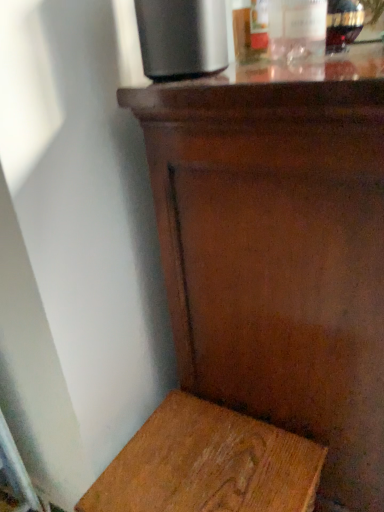
What do you see at coordinates (279, 249) in the screenshot?
I see `shiny brown wood table at center` at bounding box center [279, 249].

Identify the location of wooden stool at lower left. (208, 465).

Describe the element at coordinates (182, 38) in the screenshot. I see `satin black speaker at upper center` at that location.

The image size is (384, 512). In order to click on translucent glass bottle at upper right, which ranks as the second bottle in left-to-right order in this screenshot , I will do `click(343, 24)`.

Identify the location of shiny brown wood table at center. (279, 249).

Considering the relative positions of wooden stool at lower left and clear glass bottle at upper right, marked as the first bottle in a left-to-right arrangement, in the image provided, is wooden stool at lower left to the left or to the right of clear glass bottle at upper right, marked as the first bottle in a left-to-right arrangement,?

wooden stool at lower left is positioned on clear glass bottle at upper right, marked as the first bottle in a left-to-right arrangement,'s left side.

Does wooden stool at lower left contain clear glass bottle at upper right, marked as the 2th bottle in a right-to-left arrangement?

Actually, clear glass bottle at upper right, marked as the 2th bottle in a right-to-left arrangement, is outside wooden stool at lower left.

Considering the relative sizes of wooden stool at lower left and clear glass bottle at upper right, marked as the 2th bottle in a right-to-left arrangement, in the image provided, is wooden stool at lower left taller than clear glass bottle at upper right, marked as the 2th bottle in a right-to-left arrangement,?

Indeed, wooden stool at lower left has a greater height compared to clear glass bottle at upper right, marked as the 2th bottle in a right-to-left arrangement.

In order to click on the 2nd bottle positioned above the wooden stool at lower left (from the image's perspective) in this screenshot , I will do `click(303, 29)`.

Which of these two, wooden stool at lower left or translucent glass bottle at upper right, which ranks as the second bottle in left-to-right order, stands taller?

Standing taller between the two is wooden stool at lower left.

The height and width of the screenshot is (512, 384). In order to click on furniture that appears on the left of translucent glass bottle at upper right, the 1th bottle when ordered from right to left in this screenshot , I will do `click(208, 465)`.

Can translucent glass bottle at upper right, which ranks as the second bottle in left-to-right order, be found inside wooden stool at lower left?

No, translucent glass bottle at upper right, which ranks as the second bottle in left-to-right order, is not inside wooden stool at lower left.

Who is bigger, wooden stool at lower left or translucent glass bottle at upper right, which ranks as the second bottle in left-to-right order?

With larger size is wooden stool at lower left.

Who is taller, translucent glass bottle at upper right, the 1th bottle when ordered from right to left, or clear glass bottle at upper right, marked as the first bottle in a left-to-right arrangement?

clear glass bottle at upper right, marked as the first bottle in a left-to-right arrangement.

Is translucent glass bottle at upper right, the 1th bottle when ordered from right to left, oriented away from clear glass bottle at upper right, marked as the first bottle in a left-to-right arrangement?

No.

Considering the relative sizes of translucent glass bottle at upper right, the 1th bottle when ordered from right to left, and clear glass bottle at upper right, marked as the 2th bottle in a right-to-left arrangement, in the image provided, is translucent glass bottle at upper right, the 1th bottle when ordered from right to left, bigger than clear glass bottle at upper right, marked as the 2th bottle in a right-to-left arrangement,?

No.

From the image's perspective, which one is positioned lower, satin black speaker at upper center or wooden stool at lower left?

wooden stool at lower left appears lower in the image.

Is satin black speaker at upper center to the left or to the right of wooden stool at lower left in the image?

In the image, satin black speaker at upper center appears on the left side of wooden stool at lower left.

Is satin black speaker at upper center not near wooden stool at lower left?

They are positioned close to each other.

Is satin black speaker at upper center spatially inside wooden stool at lower left, or outside of it?

satin black speaker at upper center exists outside the volume of wooden stool at lower left.

From the picture: From the image's perspective, is clear glass bottle at upper right, marked as the 2th bottle in a right-to-left arrangement, on top of satin black speaker at upper center?

Yes, from the image's perspective, clear glass bottle at upper right, marked as the 2th bottle in a right-to-left arrangement, is over satin black speaker at upper center.

Is clear glass bottle at upper right, marked as the first bottle in a left-to-right arrangement, taller than satin black speaker at upper center?

No, clear glass bottle at upper right, marked as the first bottle in a left-to-right arrangement, is not taller than satin black speaker at upper center.

From a real-world perspective, is clear glass bottle at upper right, marked as the 2th bottle in a right-to-left arrangement, on top of satin black speaker at upper center?

Correct, in the physical world, clear glass bottle at upper right, marked as the 2th bottle in a right-to-left arrangement, is higher than satin black speaker at upper center.

How many degrees apart are the facing directions of shiny brown wood table at center and translucent glass bottle at upper right, which ranks as the second bottle in left-to-right order?

They differ by 0.698 degrees in their facing directions.

Does shiny brown wood table at center come behind translucent glass bottle at upper right, the 1th bottle when ordered from right to left?

That is False.

Considering the sizes of objects shiny brown wood table at center and translucent glass bottle at upper right, which ranks as the second bottle in left-to-right order, in the image provided, who is taller, shiny brown wood table at center or translucent glass bottle at upper right, which ranks as the second bottle in left-to-right order,?

shiny brown wood table at center.

From a real-world perspective, which object stands above the other?

translucent glass bottle at upper right, which ranks as the second bottle in left-to-right order.

Would you say wooden stool at lower left is outside satin black speaker at upper center?

wooden stool at lower left is positioned outside satin black speaker at upper center.

Is wooden stool at lower left facing towards satin black speaker at upper center?

No, wooden stool at lower left is not oriented towards satin black speaker at upper center.

From a real-world perspective, which object stands above the other?

satin black speaker at upper center, from a real-world perspective.

There is a wooden stool at lower left. Identify the location of the 2nd bottle above it (from a real-world perspective). The height and width of the screenshot is (512, 384). point(303,29).

In order to click on furniture below the translucent glass bottle at upper right, which ranks as the second bottle in left-to-right order (from a real-world perspective) in this screenshot , I will do `click(208, 465)`.

Estimate the real-world distances between objects in this image. Which object is closer to satin black speaker at upper center, wooden stool at lower left or shiny brown wood table at center?

shiny brown wood table at center is closer to satin black speaker at upper center.

Which object lies nearer to the anchor point wooden stool at lower left, translucent glass bottle at upper right, the 1th bottle when ordered from right to left, or shiny brown wood table at center?

The object closer to wooden stool at lower left is shiny brown wood table at center.

Looking at the image, which one is located closer to clear glass bottle at upper right, marked as the first bottle in a left-to-right arrangement, shiny brown wood table at center or wooden stool at lower left?

The object closer to clear glass bottle at upper right, marked as the first bottle in a left-to-right arrangement, is shiny brown wood table at center.

Looking at the image, which one is located closer to satin black speaker at upper center, translucent glass bottle at upper right, the 1th bottle when ordered from right to left, or clear glass bottle at upper right, marked as the first bottle in a left-to-right arrangement?

Among the two, clear glass bottle at upper right, marked as the first bottle in a left-to-right arrangement, is located nearer to satin black speaker at upper center.

Which object lies nearer to the anchor point shiny brown wood table at center, wooden stool at lower left or satin black speaker at upper center?

wooden stool at lower left lies closer to shiny brown wood table at center than the other object.

Looking at the image, which one is located further to wooden stool at lower left, shiny brown wood table at center or clear glass bottle at upper right, marked as the 2th bottle in a right-to-left arrangement?

clear glass bottle at upper right, marked as the 2th bottle in a right-to-left arrangement, lies further to wooden stool at lower left than the other object.

Which object lies nearer to the anchor point wooden stool at lower left, shiny brown wood table at center or translucent glass bottle at upper right, the 1th bottle when ordered from right to left?

Among the two, shiny brown wood table at center is located nearer to wooden stool at lower left.

Which object lies nearer to the anchor point satin black speaker at upper center, clear glass bottle at upper right, marked as the 2th bottle in a right-to-left arrangement, or translucent glass bottle at upper right, which ranks as the second bottle in left-to-right order?

The object closer to satin black speaker at upper center is clear glass bottle at upper right, marked as the 2th bottle in a right-to-left arrangement.

At what (x,y) coordinates should I click in order to perform the action: click on bottle between satin black speaker at upper center and translucent glass bottle at upper right, which ranks as the second bottle in left-to-right order, from left to right. Please return your answer as a coordinate pair (x, y). This screenshot has width=384, height=512. Looking at the image, I should click on (303, 29).

In order to click on table that lies between translucent glass bottle at upper right, which ranks as the second bottle in left-to-right order, and wooden stool at lower left from top to bottom in this screenshot , I will do `click(279, 249)`.

Find the location of a particular element. bottle between clear glass bottle at upper right, marked as the first bottle in a left-to-right arrangement, and wooden stool at lower left in the up-down direction is located at coordinates (343, 24).

Find the location of `table between clear glass bottle at upper right, marked as the first bottle in a left-to-right arrangement, and wooden stool at lower left, in the vertical direction`. table between clear glass bottle at upper right, marked as the first bottle in a left-to-right arrangement, and wooden stool at lower left, in the vertical direction is located at coordinates pyautogui.click(x=279, y=249).